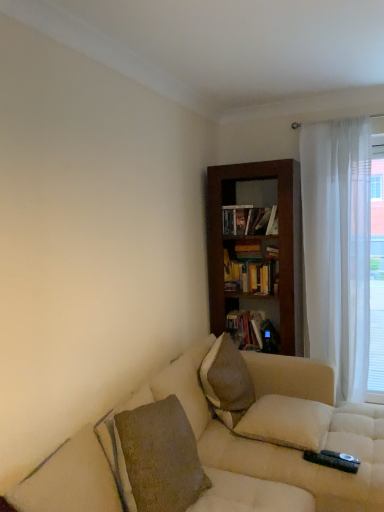
Question: Is white sheer curtain at right taller or shorter than hardcover book at upper center, which appears as the 3th book when ordered from the bottom?

Choices:
 (A) short
 (B) tall

Answer: (B)

Question: From a real-world perspective, relative to hardcover book at upper center, which is the first book in top-to-bottom order, is white sheer curtain at right vertically above or below?

Choices:
 (A) above
 (B) below

Answer: (B)

Question: Which is farther from the brown textured pillow at center, positioned as the 1th pillow in top-to-bottom order?

Choices:
 (A) white sheer curtain at right
 (B) hardcover book at upper center, which appears as the 3th book when ordered from the bottom
 (C) white soft pillow at lower right, which is the 1th pillow in bottom-to-top order
 (D) white sheer curtain at right
 (E) wooden bookshelf at center, which is the 2th book in top-to-bottom order

Answer: (A)

Question: Estimate the real-world distances between objects in this image. Which object is closer to the brown textured pillow at center, positioned as the 1th pillow in top-to-bottom order?

Choices:
 (A) matte black bookshelf at center, the third book positioned from the top
 (B) white sheer curtain at right
 (C) dark wood bookcase at center
 (D) hardcover book at upper center, which appears as the 3th book when ordered from the bottom
 (E) white sheer curtain at right

Answer: (A)